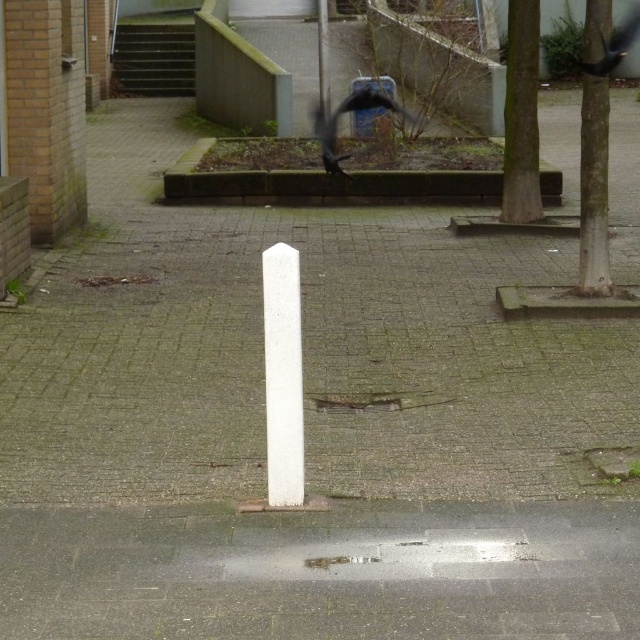
You are standing in the courtyard and want to place a small potted plant between the gray concrete pavement at center and the white stone post at center. Based on their positions, which object should the plant be closer to?

The gray concrete pavement at center is in front of the white stone post at center, so the plant should be placed closer to the white stone post at center to maintain proper spacing between them.

You are a delivery person trying to park your 1.2 meter wide cart in the courtyard. You see the gray concrete pavement at center and the white stone post at center. Which area can accommodate your cart without touching the post?

The gray concrete pavement at center has a larger width than the white stone post at center, so the cart can fit on the gray concrete pavement at center.

You are a delivery person trying to park your 1.5 meter wide cart in the courtyard. There is a gray concrete pavement at center and a white stone post at center. Can you fit your cart between them?

The gray concrete pavement at center is bigger than the white stone post at center, but the description does not provide specific measurements of the space between them. Without knowing the exact distance, it is uncertain if the 1.5 meter wide cart can fit between them.